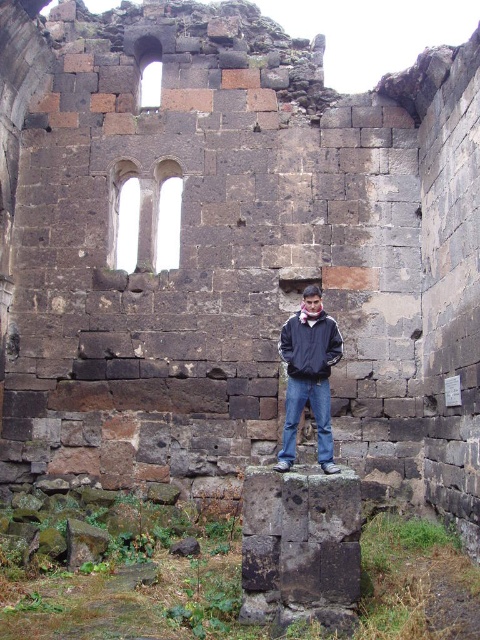
Question: Is dark blue jacket at center bigger than dark blue fabric jacket at center?

Choices:
 (A) no
 (B) yes

Answer: (B)

Question: Can you confirm if dark blue jacket at center is positioned to the right of dark blue fabric jacket at center?

Choices:
 (A) yes
 (B) no

Answer: (A)

Question: Which object is farther from the camera taking this photo?

Choices:
 (A) dark blue jacket at center
 (B) dark blue fabric jacket at center

Answer: (B)

Question: Is dark blue jacket at center further to camera compared to dark blue fabric jacket at center?

Choices:
 (A) yes
 (B) no

Answer: (B)

Question: Among these points, which one is farthest from the camera?

Choices:
 (A) (307, 369)
 (B) (327, 419)

Answer: (A)